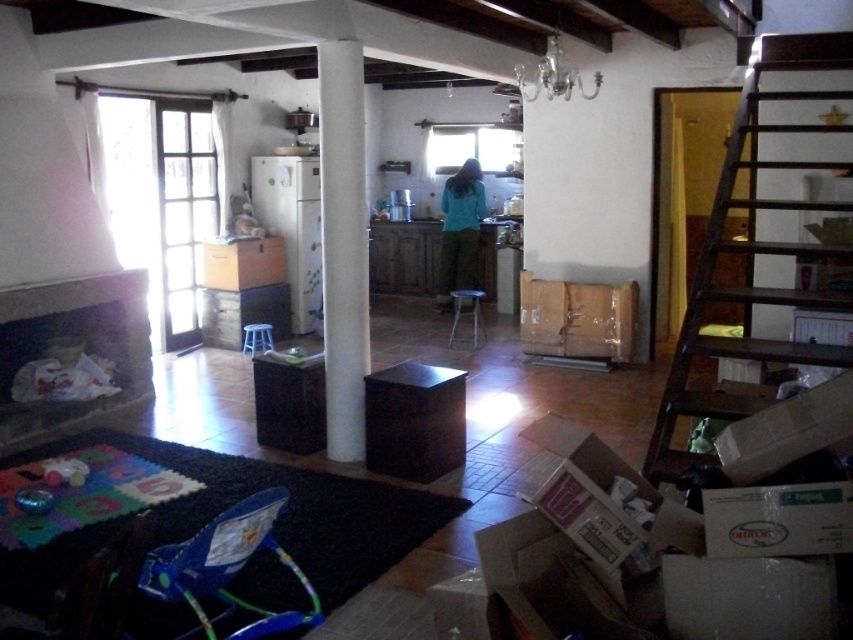
Can you confirm if matte black stool at center is positioned above blue plastic stool at center?

Indeed, matte black stool at center is positioned over blue plastic stool at center.

You are a GUI agent. You are given a task and a screenshot of the screen. Output one action in this format:
    pyautogui.click(x=<x>, y=<y>)
    Task: Click on the matte black stool at center
    
    Given the screenshot: What is the action you would take?
    pyautogui.click(x=467, y=314)

Between point (450, 337) and point (250, 333), which one is positioned in front?

Point (250, 333) is more forward.

Where is `matte black stool at center`? The height and width of the screenshot is (640, 853). matte black stool at center is located at coordinates (467, 314).

Is white matte pillar at center above blue plastic stool at center?

Yes.

Which is more to the left, white matte pillar at center or blue plastic stool at center?

blue plastic stool at center is more to the left.

Between point (325, 72) and point (248, 333), which one is positioned in front?

Positioned in front is point (325, 72).

At what (x,y) coordinates should I click in order to perform the action: click on white matte pillar at center. Please return your answer as a coordinate pair (x, y). Looking at the image, I should click on [343, 244].

Who is positioned more to the left, brown wooden ladder at right or white matte pillar at center?

From the viewer's perspective, white matte pillar at center appears more on the left side.

Is brown wooden ladder at right closer to the viewer compared to white matte pillar at center?

Yes.

Who is more forward, (758, 67) or (343, 412)?

Point (343, 412) is in front.

The image size is (853, 640). In order to click on brown wooden ladder at right in this screenshot , I will do `click(764, 234)`.